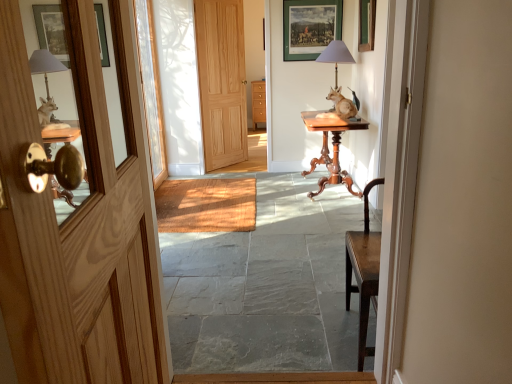
Question: Visually, is clear glass door at center positioned to the left or to the right of smooth stone floor at center?

Choices:
 (A) left
 (B) right

Answer: (A)

Question: Looking at their shapes, would you say clear glass door at center is wider or thinner than smooth stone floor at center?

Choices:
 (A) thin
 (B) wide

Answer: (A)

Question: Which object is positioned farthest from the matte gray lampshade at upper center?

Choices:
 (A) smooth stone floor at center
 (B) wooden at center
 (C) wooden door at left, the first door ordered from the bottom
 (D) matte green picture frame at upper center
 (E) mahogany wood table at center

Answer: (C)

Question: Which object is positioned closest to the mahogany wood table at center?

Choices:
 (A) wooden door at left, the first door ordered from the bottom
 (B) wooden at center
 (C) smooth stone floor at center
 (D) clear glass door at center
 (E) brown wooden statue at center

Answer: (E)